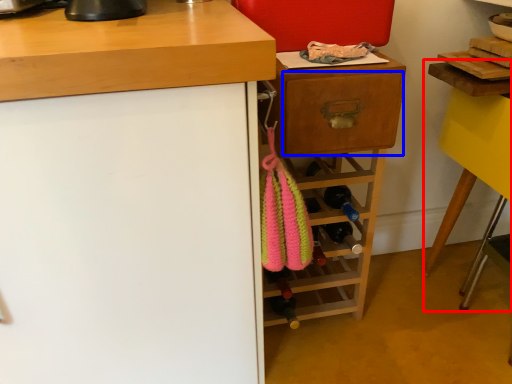
Question: Which object is further to the camera taking this photo, computer desk (highlighted by a red box) or drawer (highlighted by a blue box)?

Choices:
 (A) computer desk
 (B) drawer

Answer: (B)